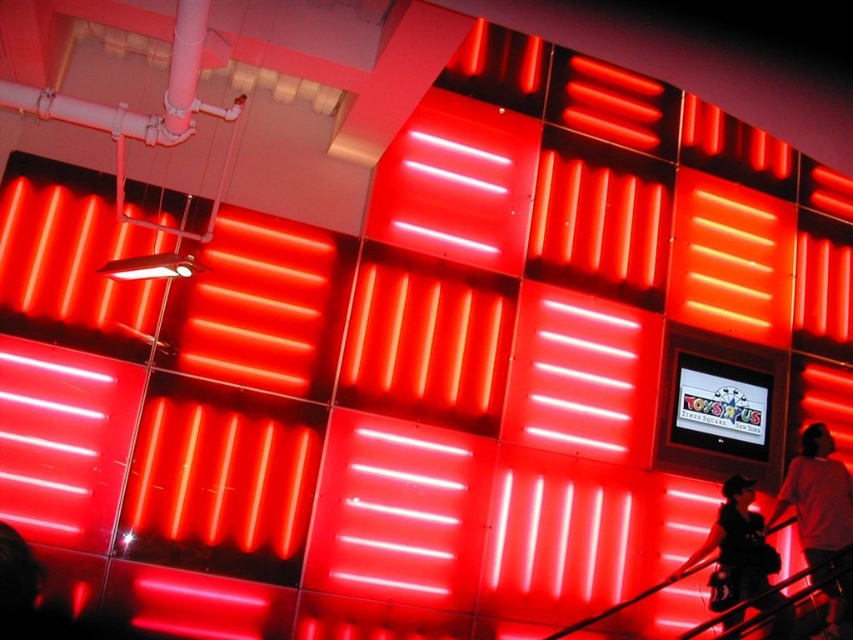
You are standing in the room and notice the white cotton shirt at lower right and the black leather boots at lower right. Which item is positioned higher from the floor?

The white cotton shirt at lower right is located above the black leather boots at lower right, so it is positioned higher from the floor.

You are standing in the room with the red neon lights. You need to locate the white cotton shirt at lower right. Where exactly is it located in the room?

The white cotton shirt at lower right is located at point (821, 518) in the room.